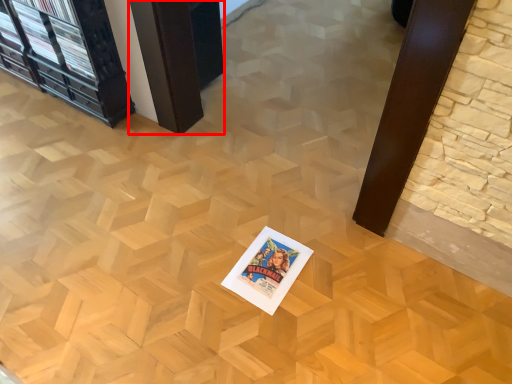
Question: Observing the image, what is the correct spatial positioning of table (annotated by the red box) in reference to postcard?

Choices:
 (A) right
 (B) left

Answer: (B)